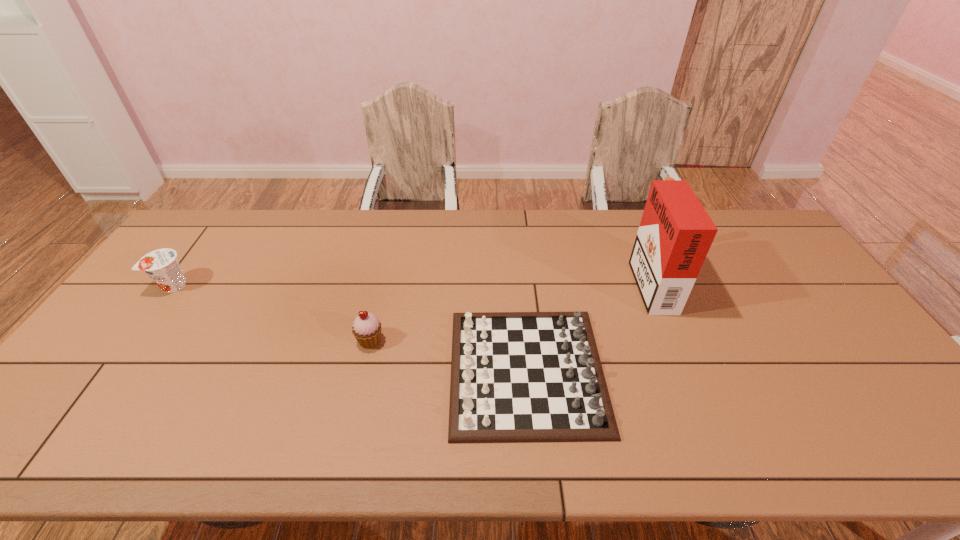
The width and height of the screenshot is (960, 540). Find the location of `the rightmost object`. the rightmost object is located at coordinates (675, 234).

At what (x,y) coordinates should I click in order to perform the action: click on cigarette case. Please return your answer as a coordinate pair (x, y). Looking at the image, I should click on (675, 234).

You are a GUI agent. You are given a task and a screenshot of the screen. Output one action in this format:
    pyautogui.click(x=<x>, y=<y>)
    Task: Click on the second object from left to right
    This screenshot has width=960, height=540.
    Given the screenshot: What is the action you would take?
    pyautogui.click(x=366, y=329)

You are a GUI agent. You are given a task and a screenshot of the screen. Output one action in this format:
    pyautogui.click(x=<x>, y=<y>)
    Task: Click on the leftmost object
    
    Given the screenshot: What is the action you would take?
    pyautogui.click(x=161, y=265)

Locate an element on the screen. Image resolution: width=960 pixels, height=540 pixels. the second object from right to left is located at coordinates (515, 376).

Locate an element on the screen. chessboard is located at coordinates (515, 376).

The image size is (960, 540). Identify the location of vacant space located on the front-facing side of the rightmost object. (577, 281).

At what (x,y) coordinates should I click in order to perform the action: click on vacant space located on the front-facing side of the rightmost object. Please return your answer as a coordinate pair (x, y). The width and height of the screenshot is (960, 540). Looking at the image, I should click on pos(590,281).

This screenshot has height=540, width=960. Find the location of `vacant area situated on the front-facing side of the rightmost object`. vacant area situated on the front-facing side of the rightmost object is located at coordinates (607, 281).

Locate an element on the screen. This screenshot has height=540, width=960. vacant region located 0.240m on the front of the cupcake is located at coordinates point(348,438).